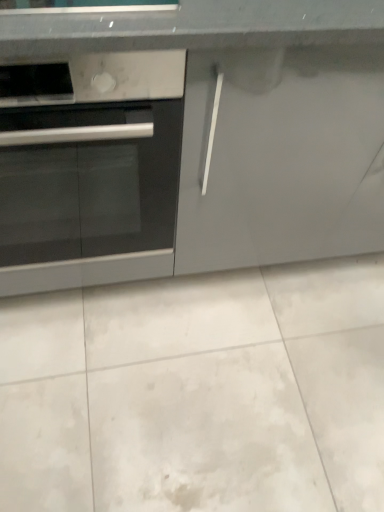
This screenshot has width=384, height=512. What do you see at coordinates (90, 170) in the screenshot?
I see `satin silver oven at left` at bounding box center [90, 170].

Measure the distance between point (38, 195) and camera.

Point (38, 195) and camera are 34.96 inches apart from each other.

Identify the location of satin silver oven at left. This screenshot has height=512, width=384. (90, 170).

Where is `satin silver oven at left`? The image size is (384, 512). satin silver oven at left is located at coordinates (90, 170).